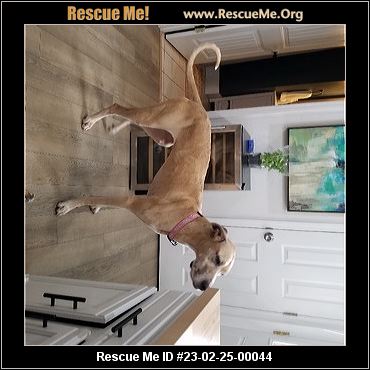
Where is `cabinet handle`? This screenshot has height=370, width=370. cabinet handle is located at coordinates 125,322, 63,298, 41,318.